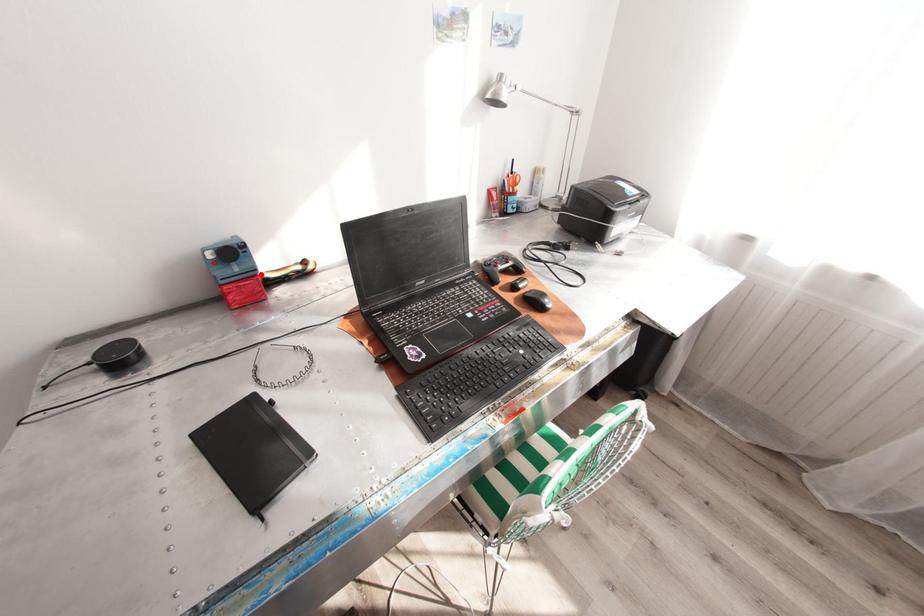
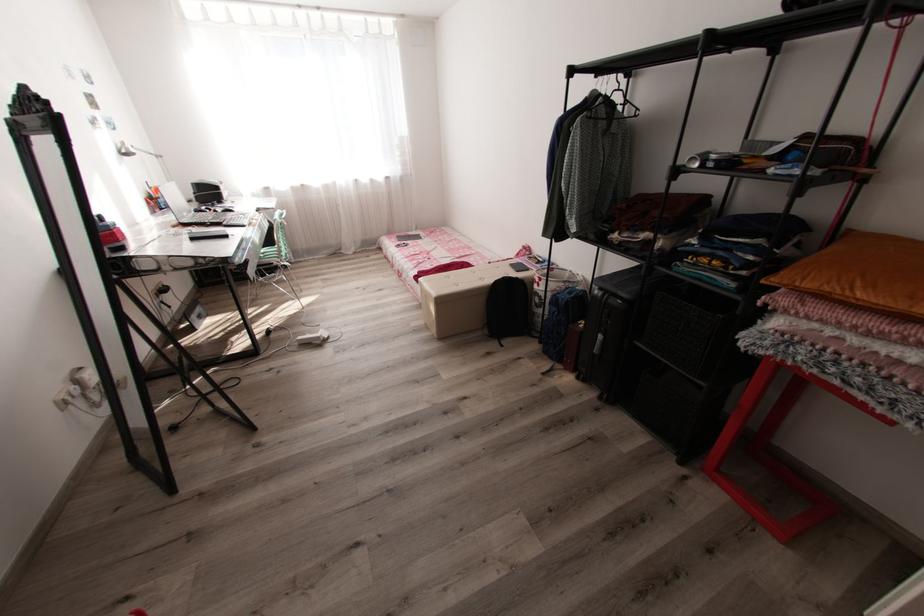
Question: I am providing you with two images of the same scene from different viewpoints. A red point is marked on the first image. Is the red point's position out of view in image 2?

Choices:
 (A) Yes
 (B) No

Answer: (A)